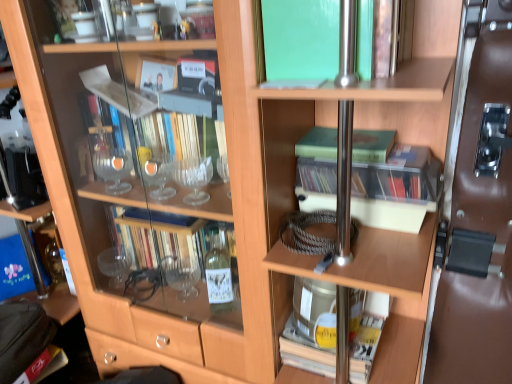
Question: Is brown leather door at right bigger or smaller than green matte book at center, acting as the 2th book starting from the top?

Choices:
 (A) big
 (B) small

Answer: (A)

Question: Is brown leather door at right taller or shorter than green matte book at center, acting as the 2th book starting from the top?

Choices:
 (A) short
 (B) tall

Answer: (B)

Question: Which is nearer to the green matte book at center, which ranks as the 4th book in bottom-to-top order?

Choices:
 (A) blue fabric box at lower left
 (B) leather handbag at lower left
 (C) clear plastic case at center, which appears as the second book when ordered from the bottom
 (D) metallic silver book at center, which is the 1th book in bottom-to-top order
 (E) green matte book at upper center, acting as the 5th book starting from the bottom

Answer: (C)

Question: Estimate the real-world distances between objects in this image. Which object is closer to the translucent plastic case at center, which appears as the 3th book when viewed from the top?

Choices:
 (A) green matte book at center, which ranks as the 4th book in bottom-to-top order
 (B) leather handbag at lower left
 (C) clear plastic case at center, the fourth book in the top-to-bottom sequence
 (D) green matte book at upper center, acting as the 5th book starting from the bottom
 (E) metallic silver book at center, which appears as the fifth book when viewed from the top

Answer: (C)